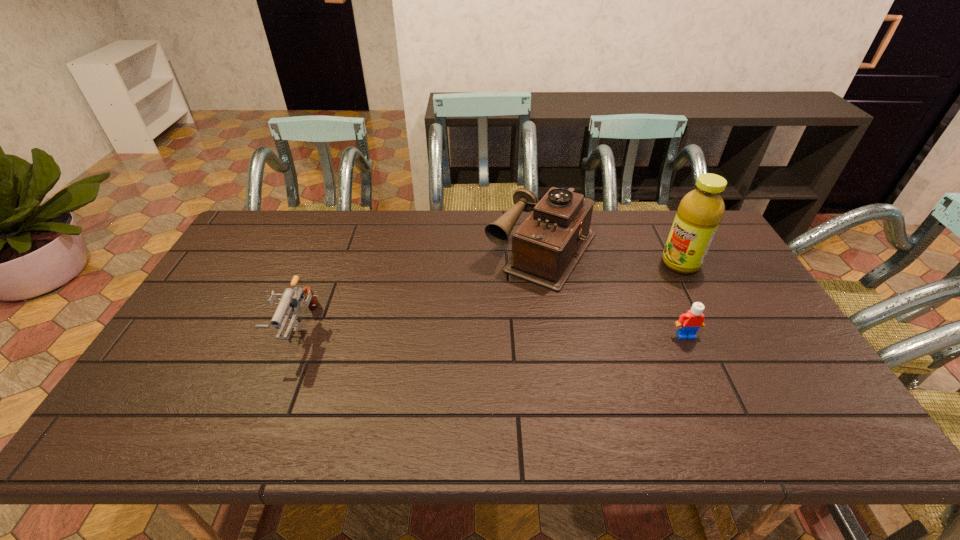
I want to click on object that is the third closest to the fruit juice, so click(x=290, y=299).

Where is `vacant space that satisfies the following two spatial constraints: 1. on the front side of the tallest object; 2. on the left side of the second tallest object`? Image resolution: width=960 pixels, height=540 pixels. vacant space that satisfies the following two spatial constraints: 1. on the front side of the tallest object; 2. on the left side of the second tallest object is located at coordinates (544, 264).